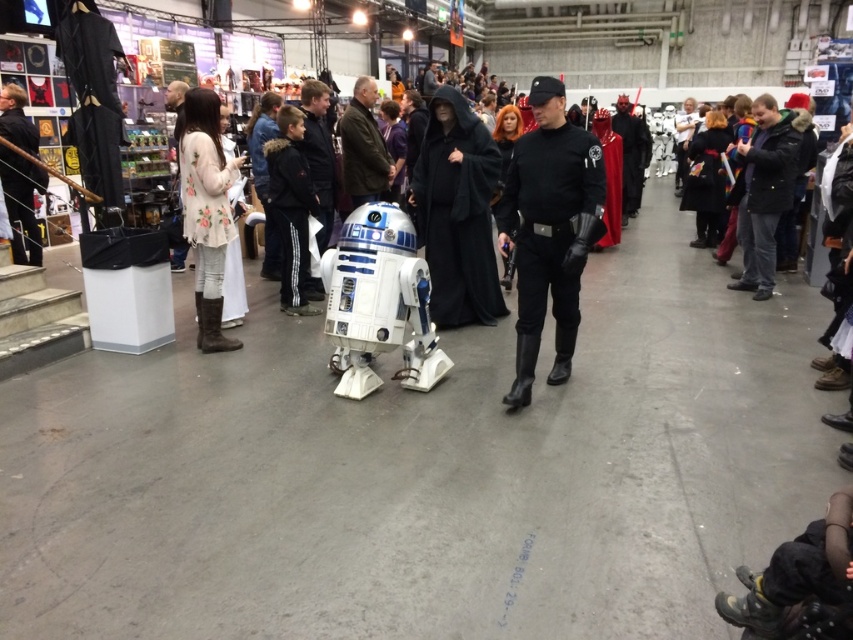
Question: Which of the following is the farthest from the observer?

Choices:
 (A) (740, 241)
 (B) (341, 170)
 (C) (224, 170)
 (D) (175, 120)

Answer: (D)

Question: Which of the following is the farthest from the observer?

Choices:
 (A) dark brown leather jacket at center
 (B) black leather jacket at upper right
 (C) floral-patterned dress at center

Answer: (C)

Question: Is black leather uniform at center to the right of floral-patterned dress at center from the viewer's perspective?

Choices:
 (A) no
 (B) yes

Answer: (B)

Question: Among these objects, which one is farthest from the camera?

Choices:
 (A) black leather uniform at center
 (B) black leather mask at upper right

Answer: (B)

Question: Can you confirm if black leather uniform at center is positioned to the right of black leather mask at upper right?

Choices:
 (A) yes
 (B) no

Answer: (B)

Question: Is dark brown leather jacket at center below floral-patterned dress at center?

Choices:
 (A) yes
 (B) no

Answer: (A)